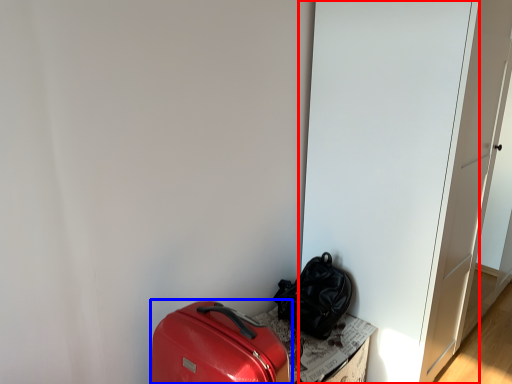
Question: Which of the following is the farthest to the observer, door (highlighted by a red box) or luggage and bags (highlighted by a blue box)?

Choices:
 (A) door
 (B) luggage and bags

Answer: (A)